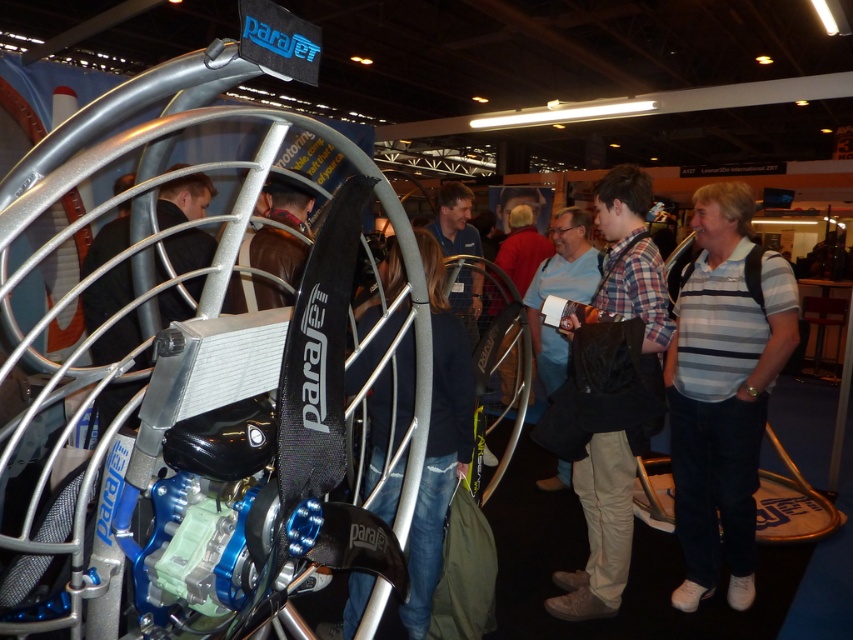
Question: Estimate the real-world distances between objects in this image. Which object is farther from the plaid fabric shirt at center?

Choices:
 (A) white striped shirt at right
 (B) dark blue denim jeans at center

Answer: (B)

Question: Which of the following is the farthest from the observer?

Choices:
 (A) white striped shirt at right
 (B) dark blue denim jeans at center
 (C) plaid fabric shirt at center

Answer: (A)

Question: Considering the relative positions of white striped shirt at right and plaid fabric shirt at center in the image provided, where is white striped shirt at right located with respect to plaid fabric shirt at center?

Choices:
 (A) above
 (B) below

Answer: (B)

Question: Can you confirm if white striped shirt at right is bigger than plaid fabric shirt at center?

Choices:
 (A) no
 (B) yes

Answer: (A)

Question: Which point is farther to the camera?

Choices:
 (A) dark blue denim jeans at center
 (B) plaid fabric shirt at center

Answer: (B)

Question: Does white striped shirt at right have a smaller size compared to dark blue denim jeans at center?

Choices:
 (A) no
 (B) yes

Answer: (B)